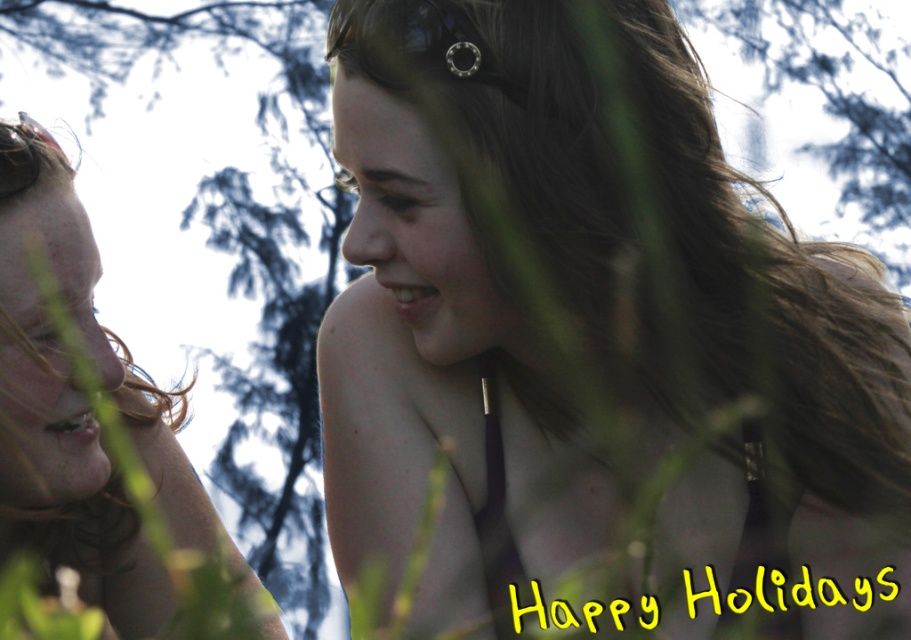
You are a photographer trying to capture the perfect shot of the two people in the image. You want to ensure that both the smooth brown hair at center and the matte purple bikini top at center are clearly visible in your photo. Based on their positions, which object should you focus on first to ensure both are in focus?

The smooth brown hair at center is above the matte purple bikini top at center. To ensure both are in focus, you should focus on the smooth brown hair at center first since it is closer to the camera, allowing the bikini top to fall within the depth of field.

You are a photographer trying to capture a clear shot of the matte purple bikini top at center and the shiny metallic goggles at upper left. Which object is closer to the camera based on their positions in the scene?

The matte purple bikini top at center is closer to the camera than the shiny metallic goggles at upper left because it is further to the viewer according to the description.